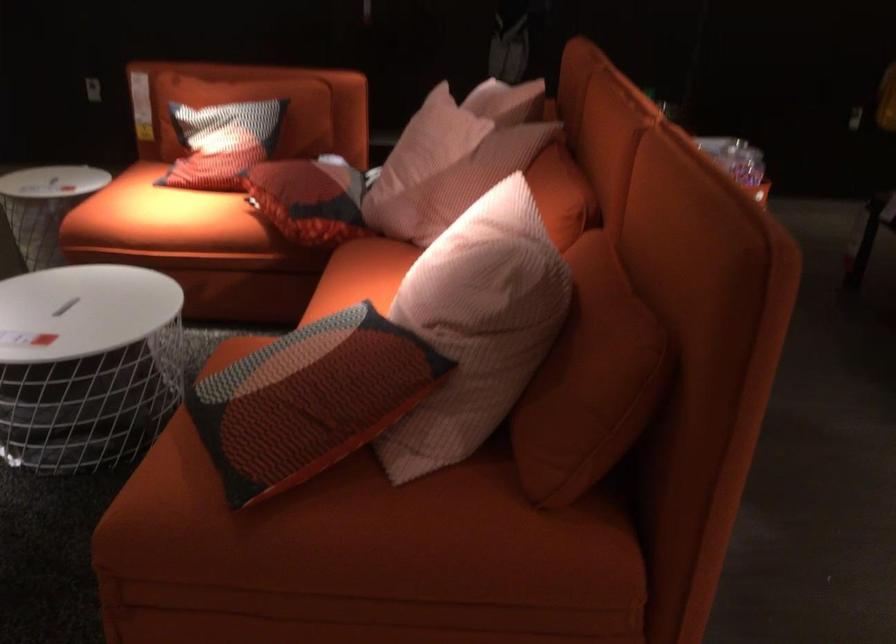
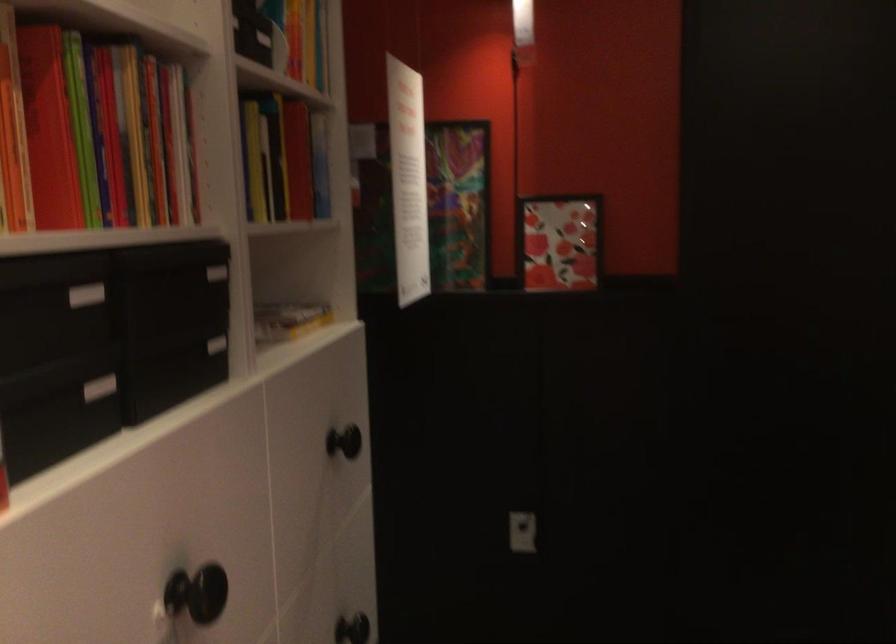
Which direction would the cameraman need to move to produce the second image?

The cameraman moved toward left, forward.